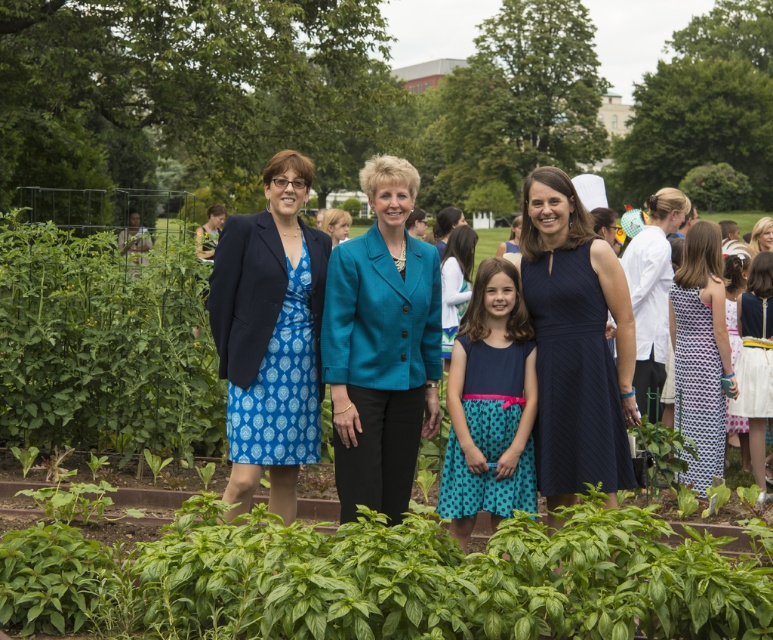
Can you confirm if green leafy plants at center is positioned to the left of navy blue dress at center?

Indeed, green leafy plants at center is positioned on the left side of navy blue dress at center.

Does green leafy plants at center appear over navy blue dress at center?

Actually, green leafy plants at center is below navy blue dress at center.

Describe the element at coordinates (382, 579) in the screenshot. This screenshot has height=640, width=773. I see `green leafy plants at center` at that location.

Image resolution: width=773 pixels, height=640 pixels. I want to click on green leafy plants at center, so click(x=382, y=579).

Who is more forward, (x=373, y=262) or (x=676, y=358)?

Positioned in front is point (x=373, y=262).

Can you confirm if teal fabric jacket at center is positioned below blue dotted dress at right?

No.

Is point (416, 192) less distant than point (680, 419)?

That is True.

Locate an element on the screen. Image resolution: width=773 pixels, height=640 pixels. teal fabric jacket at center is located at coordinates (380, 346).

Which of these two, matte blue dress at center or teal dotted dress at center, stands taller?

matte blue dress at center

At what (x,y) coordinates should I click in order to perform the action: click on matte blue dress at center. Please return your answer as a coordinate pair (x, y). Looking at the image, I should click on pos(271,337).

What are the coordinates of `matte blue dress at center` in the screenshot? It's located at (271, 337).